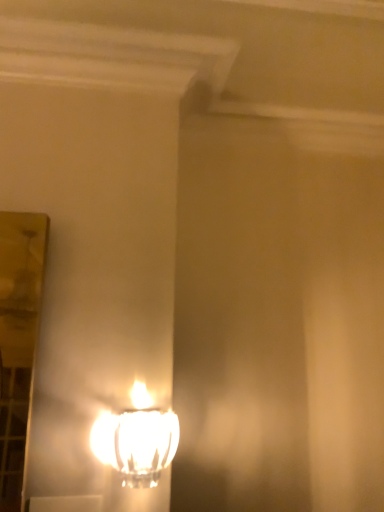
Locate an element on the screen. Image resolution: width=384 pixels, height=512 pixels. translucent glass candle at center is located at coordinates (137, 440).

The width and height of the screenshot is (384, 512). Describe the element at coordinates (137, 440) in the screenshot. I see `translucent glass candle at center` at that location.

The image size is (384, 512). In order to click on translucent glass candle at center in this screenshot , I will do `click(137, 440)`.